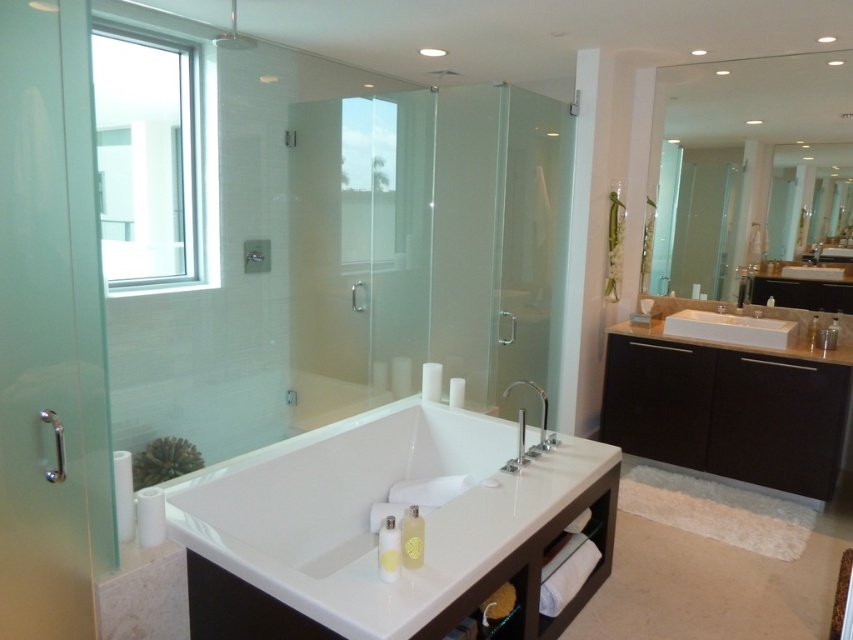
You are a contractor planning to install a new grab bar in the bathroom. You see the satin nickel grab bar at lower left at point (55,445). Is the existing grab bar positioned where you intended to place the new one?

The satin nickel grab bar at lower left is located at point (55,445), so yes, the existing grab bar is exactly where you intended to place the new one.

You are a contractor measuring the bathroom layout. You need to install a new 4.0 meters long pipe that connects the clear glass mirror at upper right to the satin nickel grab bar at lower left. Can the pipe be installed without bending?

The distance between the clear glass mirror at upper right and the satin nickel grab bar at lower left is 3.80 meters. Since the pipe is 4.0 meters long, it is longer than the required distance. Therefore, the pipe can be installed without bending, as there is sufficient length to accommodate the connection.